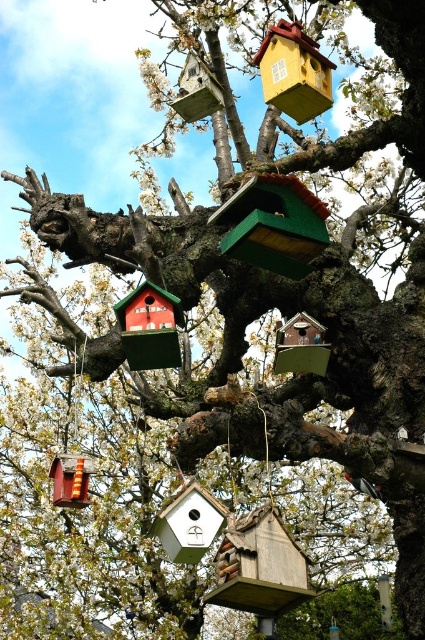
Is green matte bird feeder at center to the left of yellow matte birdhouse at upper center from the viewer's perspective?

Yes, green matte bird feeder at center is to the left of yellow matte birdhouse at upper center.

Does point (223, 214) come farther from viewer compared to point (285, 70)?

No, it is not.

I want to click on green matte bird feeder at center, so click(274, 225).

The image size is (425, 640). In order to click on green matte bird feeder at center in this screenshot , I will do `click(274, 225)`.

Identify the location of wooden birdhouse at center. This screenshot has width=425, height=640. click(x=260, y=568).

In the scene shown: Who is shorter, wooden birdhouse at center or white matte bird feeder at center?

With less height is white matte bird feeder at center.

Between point (277, 516) and point (195, 502), which one is positioned in front?

Point (277, 516)

The image size is (425, 640). Identify the location of wooden birdhouse at center. (260, 568).

Does green matte bird feeder at center appear on the left side of wooden birdhouse at center?

Incorrect, green matte bird feeder at center is not on the left side of wooden birdhouse at center.

The height and width of the screenshot is (640, 425). Describe the element at coordinates (274, 225) in the screenshot. I see `green matte bird feeder at center` at that location.

Identify the location of green matte bird feeder at center. Image resolution: width=425 pixels, height=640 pixels. (274, 225).